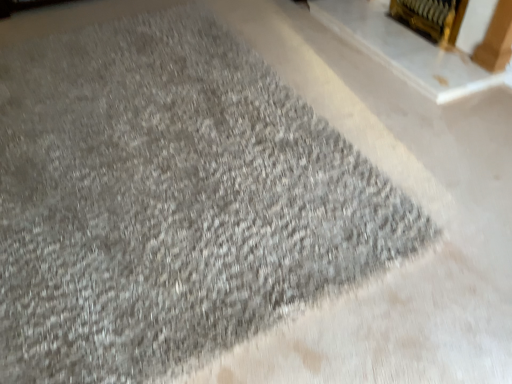
Question: From the image's perspective, does gold metallic fireplace at upper right, acting as the first fireplace starting from the right, appear lower than gold metallic fireplace at upper right, which appears as the first fireplace when viewed from the left?

Choices:
 (A) no
 (B) yes

Answer: (A)

Question: Can you confirm if gold metallic fireplace at upper right, which is the 2th fireplace in left-to-right order, is smaller than gold metallic fireplace at upper right, positioned as the second fireplace in right-to-left order?

Choices:
 (A) no
 (B) yes

Answer: (A)

Question: From the image's perspective, does gold metallic fireplace at upper right, acting as the first fireplace starting from the right, appear higher than gold metallic fireplace at upper right, positioned as the second fireplace in right-to-left order?

Choices:
 (A) yes
 (B) no

Answer: (A)

Question: Considering the relative positions of gold metallic fireplace at upper right, which is the 2th fireplace in left-to-right order, and gold metallic fireplace at upper right, positioned as the second fireplace in right-to-left order, in the image provided, is gold metallic fireplace at upper right, which is the 2th fireplace in left-to-right order, behind gold metallic fireplace at upper right, positioned as the second fireplace in right-to-left order,?

Choices:
 (A) no
 (B) yes

Answer: (B)

Question: Can you confirm if gold metallic fireplace at upper right, acting as the first fireplace starting from the right, is bigger than gold metallic fireplace at upper right, positioned as the second fireplace in right-to-left order?

Choices:
 (A) no
 (B) yes

Answer: (B)

Question: Does gold metallic fireplace at upper right, acting as the first fireplace starting from the right, lie in front of gold metallic fireplace at upper right, which appears as the first fireplace when viewed from the left?

Choices:
 (A) yes
 (B) no

Answer: (B)

Question: Would you say gold metallic fireplace at upper right, positioned as the second fireplace in right-to-left order, contains gold metallic fireplace at upper right, which is the 2th fireplace in left-to-right order?

Choices:
 (A) yes
 (B) no

Answer: (B)

Question: From a real-world perspective, is gold metallic fireplace at upper right, positioned as the second fireplace in right-to-left order, positioned over gold metallic fireplace at upper right, acting as the first fireplace starting from the right, based on gravity?

Choices:
 (A) yes
 (B) no

Answer: (B)

Question: Does gold metallic fireplace at upper right, positioned as the second fireplace in right-to-left order, have a lesser height compared to gold metallic fireplace at upper right, which is the 2th fireplace in left-to-right order?

Choices:
 (A) yes
 (B) no

Answer: (A)

Question: Is gold metallic fireplace at upper right, which appears as the first fireplace when viewed from the left, aimed at gold metallic fireplace at upper right, which is the 2th fireplace in left-to-right order?

Choices:
 (A) no
 (B) yes

Answer: (A)

Question: Would you say gold metallic fireplace at upper right, which appears as the first fireplace when viewed from the left, is outside gold metallic fireplace at upper right, acting as the first fireplace starting from the right?

Choices:
 (A) yes
 (B) no

Answer: (A)

Question: Considering the relative positions of gold metallic fireplace at upper right, positioned as the second fireplace in right-to-left order, and gold metallic fireplace at upper right, acting as the first fireplace starting from the right, in the image provided, is gold metallic fireplace at upper right, positioned as the second fireplace in right-to-left order, to the left of gold metallic fireplace at upper right, acting as the first fireplace starting from the right, from the viewer's perspective?

Choices:
 (A) yes
 (B) no

Answer: (A)

Question: Would you say gold metallic fireplace at upper right, acting as the first fireplace starting from the right, is to the left or to the right of gold metallic fireplace at upper right, positioned as the second fireplace in right-to-left order, in the picture?

Choices:
 (A) right
 (B) left

Answer: (A)